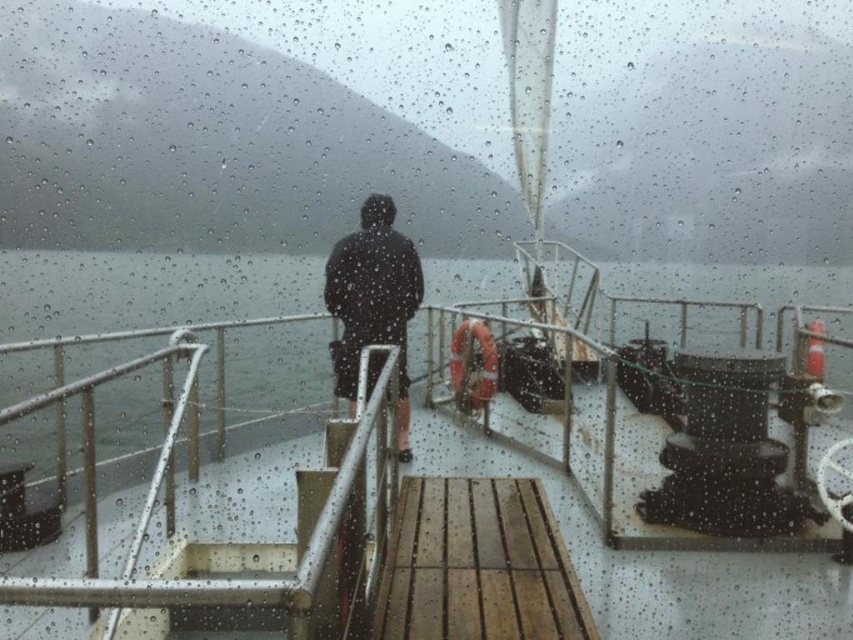
Question: From the image, what is the correct spatial relationship of wooden at center in relation to dark matte jacket at center?

Choices:
 (A) below
 (B) above

Answer: (A)

Question: Among these objects, which one is nearest to the camera?

Choices:
 (A) dark matte jacket at center
 (B) wooden at center

Answer: (B)

Question: Which of the following is the closest to the observer?

Choices:
 (A) [x=404, y=348]
 (B) [x=457, y=625]

Answer: (B)

Question: Which of the following is the closest to the observer?

Choices:
 (A) (405, 412)
 (B) (424, 566)

Answer: (B)

Question: Does wooden at center appear on the right side of dark matte jacket at center?

Choices:
 (A) yes
 (B) no

Answer: (A)

Question: Is wooden at center smaller than dark matte jacket at center?

Choices:
 (A) yes
 (B) no

Answer: (A)